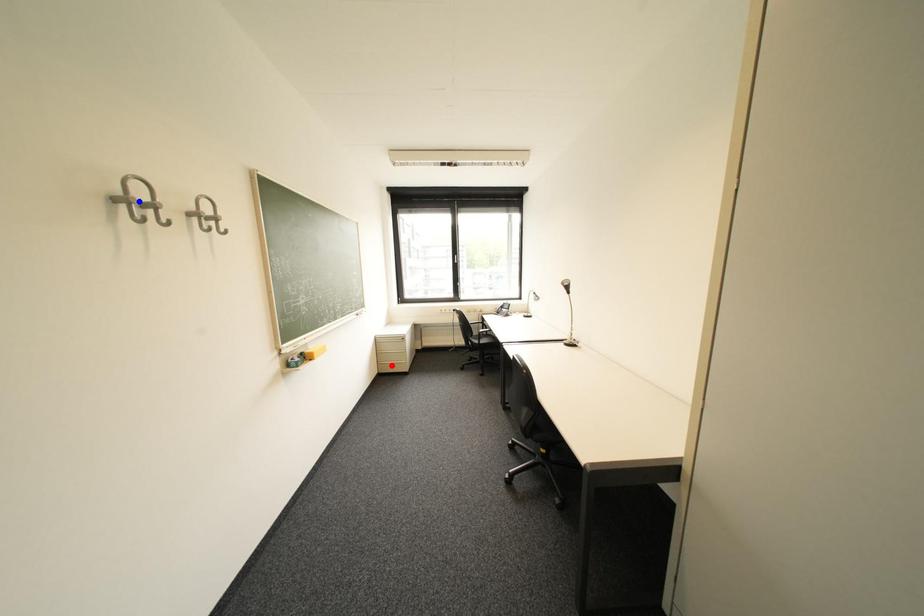
Question: Which of the two points in the image is closer to the camera?

Choices:
 (A) Blue point is closer.
 (B) Red point is closer.

Answer: (A)